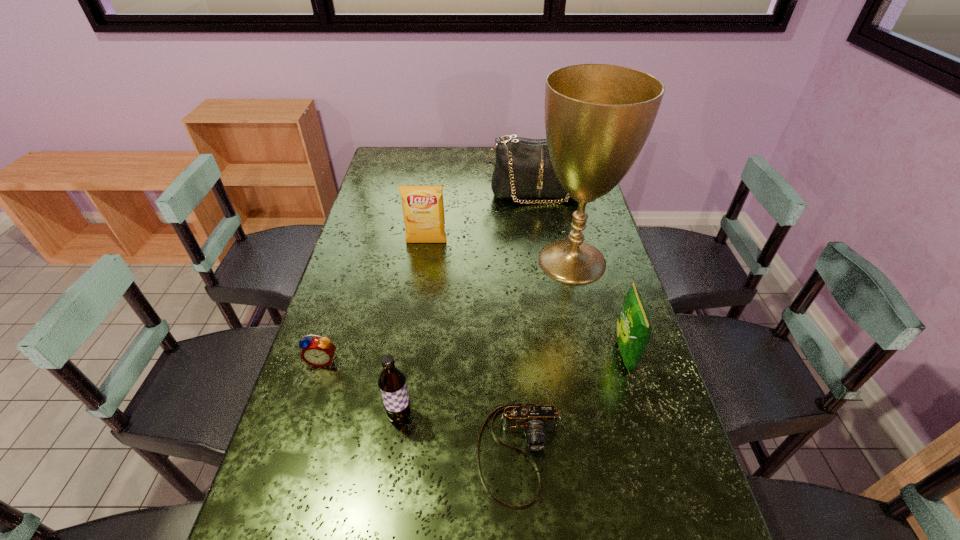
At what (x,y) coordinates should I click in order to perform the action: click on crisp (potato chip) present at the right edge. Please return your answer as a coordinate pair (x, y). The image size is (960, 540). Looking at the image, I should click on (633, 328).

Where is `free space at the far edge of the desktop`? Image resolution: width=960 pixels, height=540 pixels. free space at the far edge of the desktop is located at coordinates (442, 154).

The image size is (960, 540). In the image, there is a desktop. Identify the location of vacant region at the left edge. (393, 226).

Image resolution: width=960 pixels, height=540 pixels. What are the coordinates of `free space at the right edge of the desktop` in the screenshot? It's located at (642, 376).

Where is `vacant space that's between the shorter crisp (potato chip) and the tallest object`? The height and width of the screenshot is (540, 960). vacant space that's between the shorter crisp (potato chip) and the tallest object is located at coordinates (598, 307).

The height and width of the screenshot is (540, 960). Identify the location of free spot between the trophy cup and the alarm clock. (447, 310).

Where is `free space between the farther crisp (potato chip) and the handbag`? This screenshot has height=540, width=960. free space between the farther crisp (potato chip) and the handbag is located at coordinates (481, 219).

Locate an element on the screen. The width and height of the screenshot is (960, 540). free space between the camera and the farther crisp (potato chip) is located at coordinates (473, 348).

Where is `vacant space that's between the shortest object and the root beer`? The width and height of the screenshot is (960, 540). vacant space that's between the shortest object and the root beer is located at coordinates (460, 434).

At what (x,y) coordinates should I click in order to perform the action: click on free point between the right crisp (potato chip) and the farther crisp (potato chip). Please return your answer as a coordinate pair (x, y). Image resolution: width=960 pixels, height=540 pixels. Looking at the image, I should click on (525, 299).